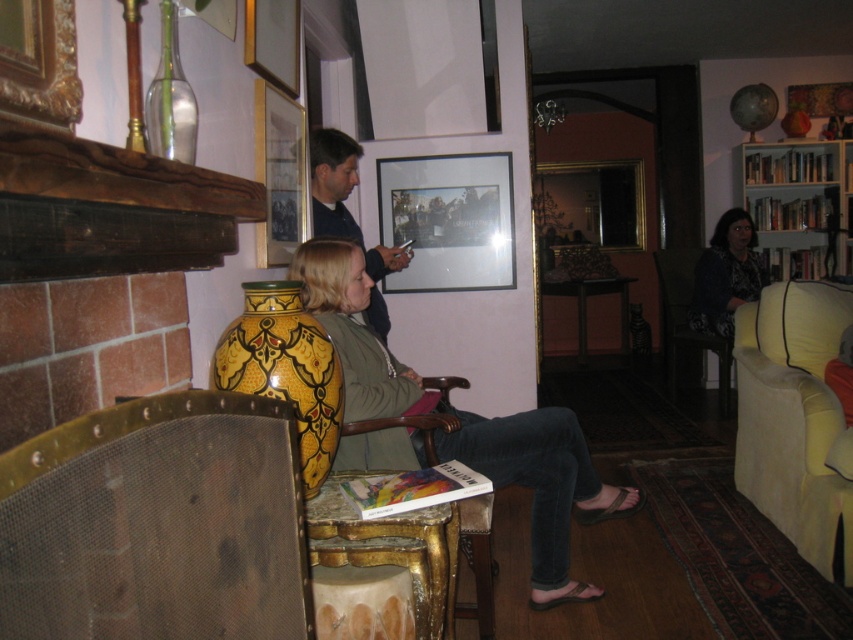
In the scene shown: Is metallic mesh chair at lower left wider than matte black shirt at center?

In fact, metallic mesh chair at lower left might be narrower than matte black shirt at center.

In the scene shown: Is metallic mesh chair at lower left bigger than matte black shirt at center?

Incorrect, metallic mesh chair at lower left is not larger than matte black shirt at center.

This screenshot has height=640, width=853. Describe the element at coordinates (155, 524) in the screenshot. I see `metallic mesh chair at lower left` at that location.

This screenshot has width=853, height=640. I want to click on metallic mesh chair at lower left, so click(155, 524).

Can you confirm if metallic mesh chair at lower left is positioned below matte glass picture frame at center?

Indeed, metallic mesh chair at lower left is positioned under matte glass picture frame at center.

This screenshot has width=853, height=640. I want to click on metallic mesh chair at lower left, so click(155, 524).

Is metallic mesh chair at lower left wider than gold/gilded wood chair at center?

In fact, metallic mesh chair at lower left might be narrower than gold/gilded wood chair at center.

Which of these two, metallic mesh chair at lower left or gold/gilded wood chair at center, stands shorter?

Standing shorter between the two is metallic mesh chair at lower left.

The height and width of the screenshot is (640, 853). What are the coordinates of `metallic mesh chair at lower left` in the screenshot? It's located at (155, 524).